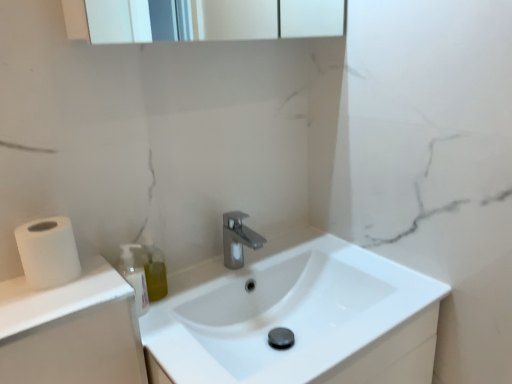
What are the coordinates of `vacant space to the right of satin nickel faucet at center` in the screenshot? It's located at (298, 249).